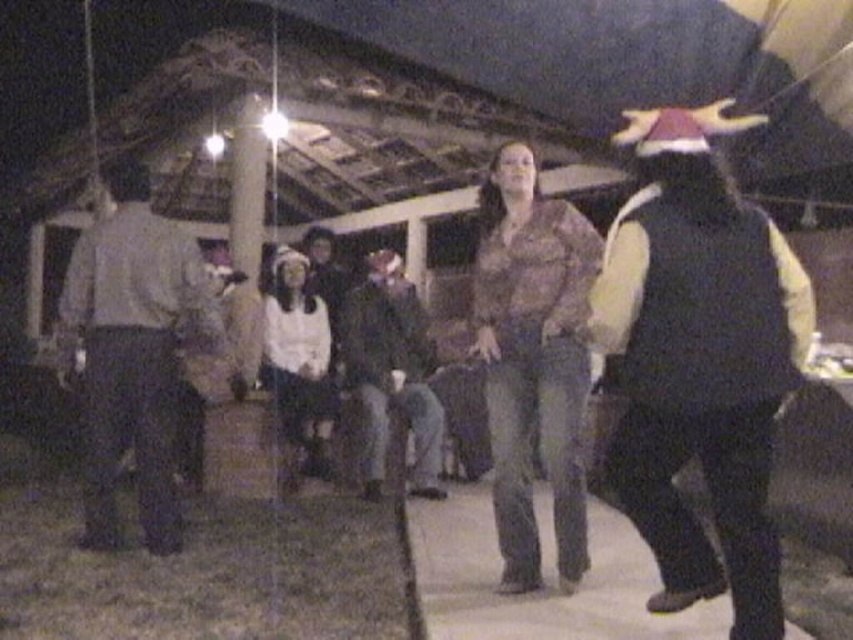
Question: Which point is farther from the camera taking this photo?

Choices:
 (A) (363, 285)
 (B) (729, 179)

Answer: (A)

Question: Is light brown leather jacket at left below dark gray jeans at center?

Choices:
 (A) no
 (B) yes

Answer: (A)

Question: Which object is closer to the camera taking this photo?

Choices:
 (A) dark gray jeans at center
 (B) dark gray vest at right

Answer: (B)

Question: Considering the relative positions of light brown leather jacket at left and dark gray jeans at center in the image provided, where is light brown leather jacket at left located with respect to dark gray jeans at center?

Choices:
 (A) right
 (B) left

Answer: (B)

Question: Does light brown leather jacket at left appear under dark gray jeans at center?

Choices:
 (A) no
 (B) yes

Answer: (A)

Question: Which of these objects is positioned closest to the light brown leather jacket at left?

Choices:
 (A) dark gray vest at right
 (B) dark gray jeans at center

Answer: (B)